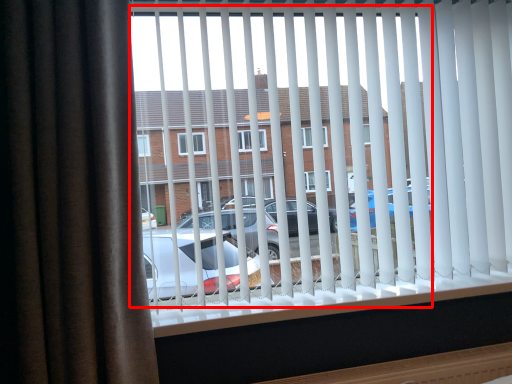
Question: From the image's perspective, where is bay window (annotated by the red box) located relative to curtain?

Choices:
 (A) below
 (B) above

Answer: (B)